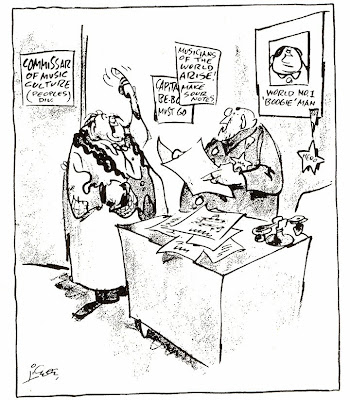
Where is `wall`? This screenshot has width=350, height=400. wall is located at coordinates (126, 32).